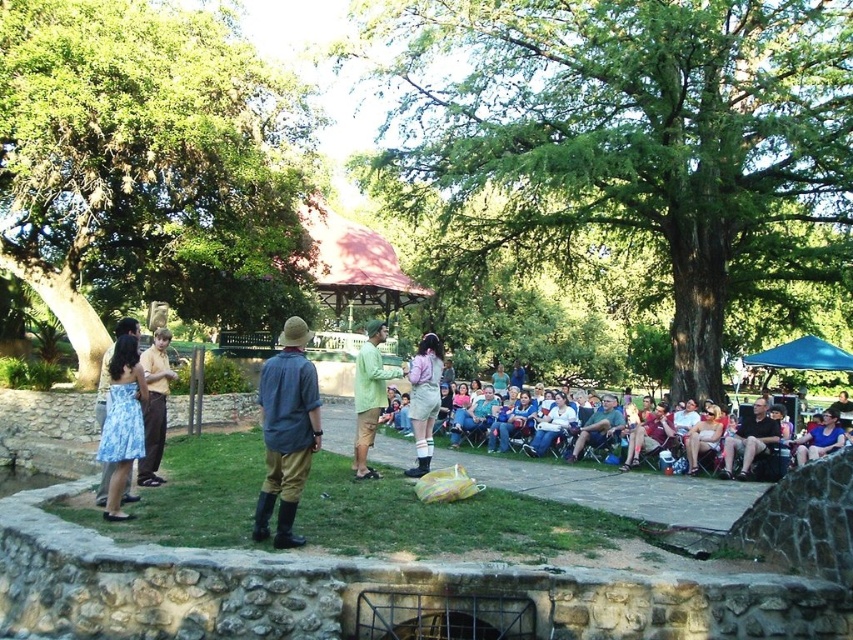
Question: Can you confirm if matte yellow shirt at left is positioned above dark gray fabric chair at lower right?

Choices:
 (A) no
 (B) yes

Answer: (B)

Question: Which point appears farthest from the camera in this image?

Choices:
 (A) (158, 481)
 (B) (177, 240)
 (C) (262, 426)
 (D) (113, 518)

Answer: (B)

Question: Among these objects, which one is farthest from the camera?

Choices:
 (A) blue floral dress at lower left
 (B) matte yellow shirt at left
 (C) pink fabric overalls at center

Answer: (C)

Question: Does denim shirt at center come behind green matte shirt at center?

Choices:
 (A) no
 (B) yes

Answer: (A)

Question: Is green leafy tree at upper left below green matte shirt at center?

Choices:
 (A) yes
 (B) no

Answer: (B)

Question: Which of the following is the closest to the observer?

Choices:
 (A) matte yellow shirt at left
 (B) dark gray fabric chair at lower right
 (C) green leafy tree at upper left

Answer: (A)